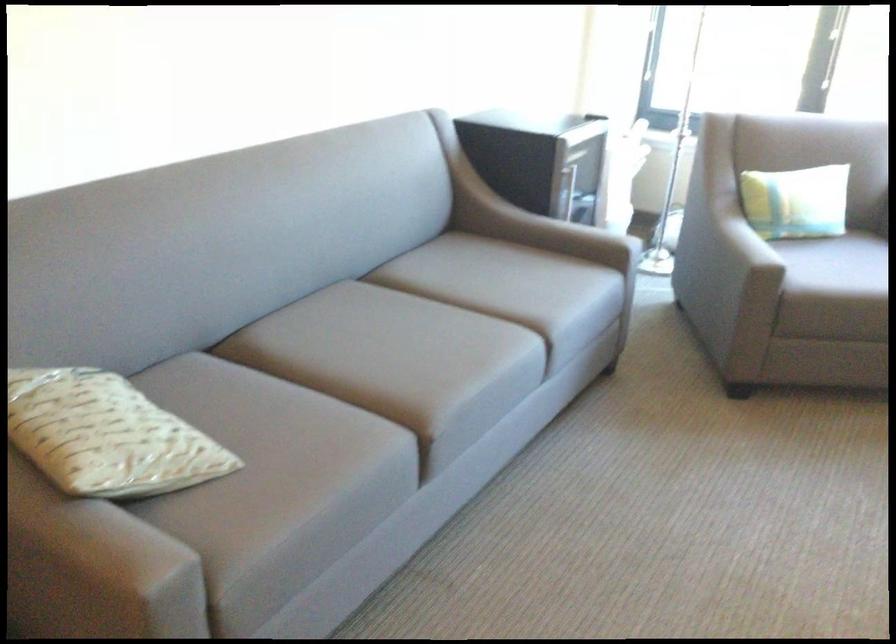
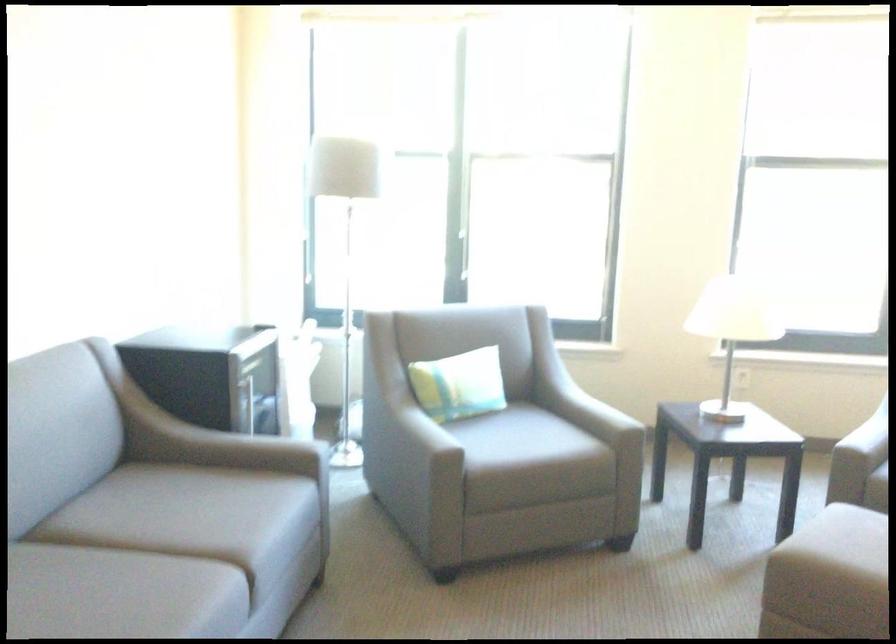
Locate, in the second image, the point that corresponds to (824,261) in the first image.

(495, 431)